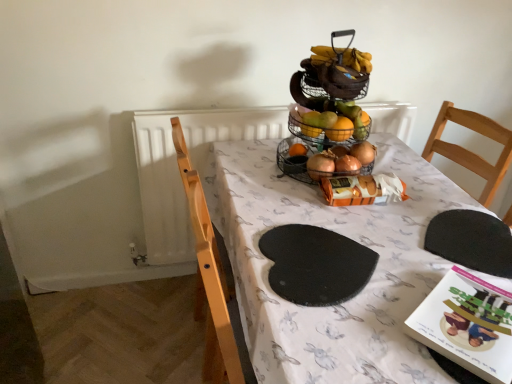
I want to click on blank space situated above white paper book at lower right (from a real-world perspective), so click(472, 312).